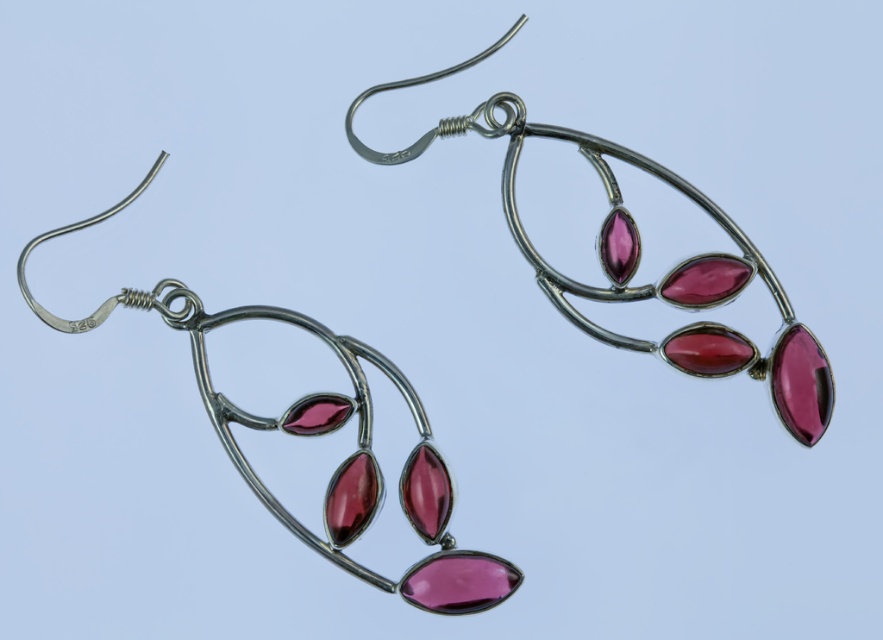
You are a jeweler examining two pairs of matte silver earrings. You notice that the matte silver earrings at center and the matte silver earrings at left are displayed in a showcase. Based on their positions, which pair is placed higher up?

The matte silver earrings at center is positioned over matte silver earrings at left, so the matte silver earrings at center is placed higher up.